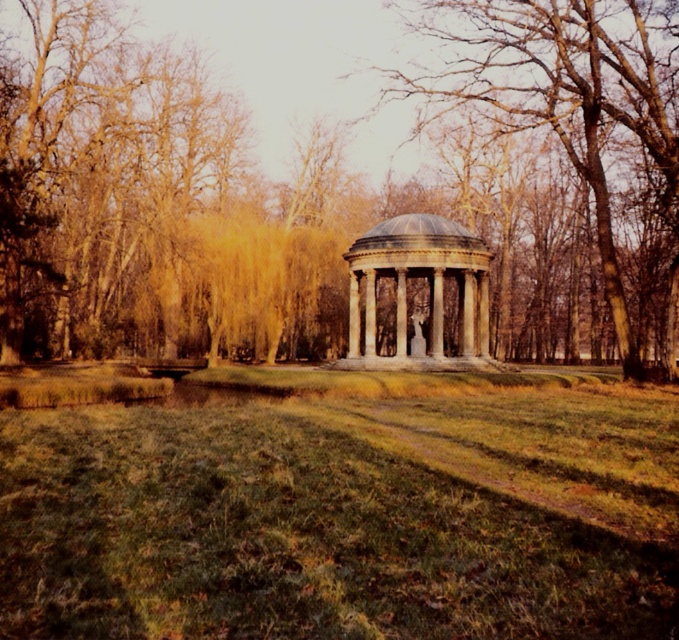
Question: Is brown wood tree at center thinner than white marble gazebo at center?

Choices:
 (A) no
 (B) yes

Answer: (A)

Question: Is brown wood tree at center above smooth gray stone gazebo at center?

Choices:
 (A) yes
 (B) no

Answer: (B)

Question: Which of these objects is positioned farthest from the green grassy field at center?

Choices:
 (A) smooth gray stone gazebo at center
 (B) brown wood tree at center

Answer: (A)

Question: Where is green grassy field at center located in relation to white marble gazebo at center in the image?

Choices:
 (A) below
 (B) above

Answer: (A)

Question: Which object is positioned farthest from the brown wood tree at center?

Choices:
 (A) smooth gray stone gazebo at center
 (B) green grassy field at center

Answer: (B)

Question: Among these objects, which one is farthest from the camera?

Choices:
 (A) smooth gray stone gazebo at center
 (B) brown wood tree at center
 (C) green grassy field at center

Answer: (B)